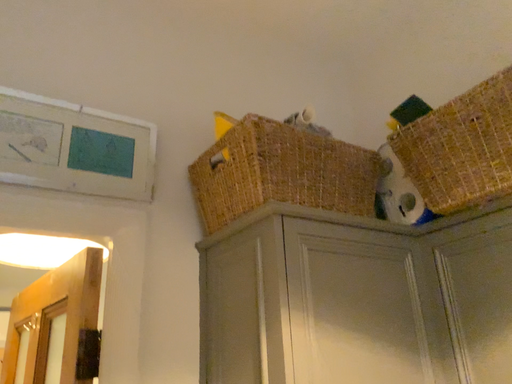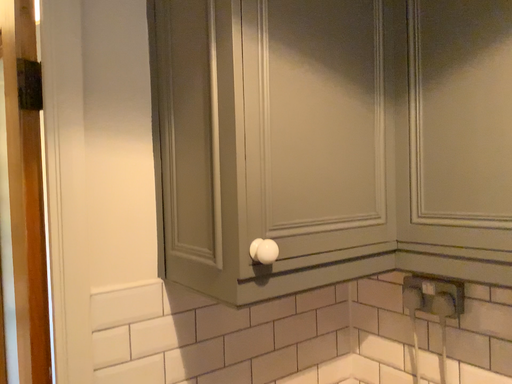
Question: How did the camera likely rotate when shooting the video?

Choices:
 (A) rotated upward
 (B) rotated downward

Answer: (B)